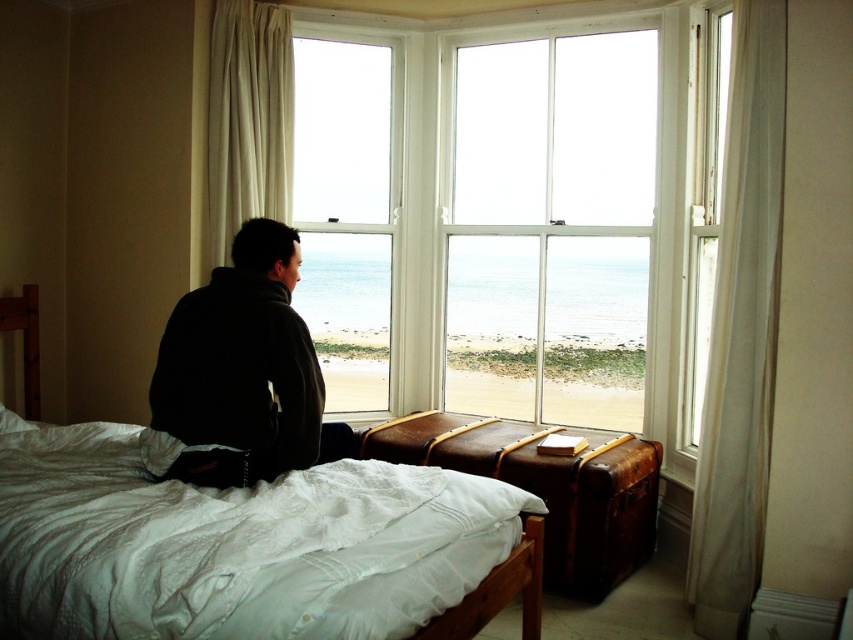
Can you confirm if dark matte jacket at center is positioned above white sheer curtain at left?

Actually, dark matte jacket at center is below white sheer curtain at left.

Consider the image. Measure the distance from dark matte jacket at center to white sheer curtain at left.

3.89 feet

The width and height of the screenshot is (853, 640). What do you see at coordinates (241, 374) in the screenshot?
I see `dark matte jacket at center` at bounding box center [241, 374].

This screenshot has width=853, height=640. What are the coordinates of `dark matte jacket at center` in the screenshot? It's located at (241, 374).

Is white cotton bed at center wider than dark matte jacket at center?

Yes, white cotton bed at center is wider than dark matte jacket at center.

Looking at this image, can you confirm if white cotton bed at center is positioned to the left of dark matte jacket at center?

In fact, white cotton bed at center is to the right of dark matte jacket at center.

Does point (257, 554) lie behind point (299, 317)?

No, (257, 554) is closer to viewer.

At what (x,y) coordinates should I click in order to perform the action: click on white cotton bed at center. Please return your answer as a coordinate pair (x, y). This screenshot has width=853, height=640. Looking at the image, I should click on (250, 547).

Is white cotton bed at center taller than white sheer curtain at left?

No, white cotton bed at center is not taller than white sheer curtain at left.

Locate an element on the screen. This screenshot has height=640, width=853. white cotton bed at center is located at coordinates (250, 547).

Between point (103, 481) and point (210, 144), which one is positioned behind?

Positioned behind is point (210, 144).

Find the location of a particular element. The image size is (853, 640). white cotton bed at center is located at coordinates (250, 547).